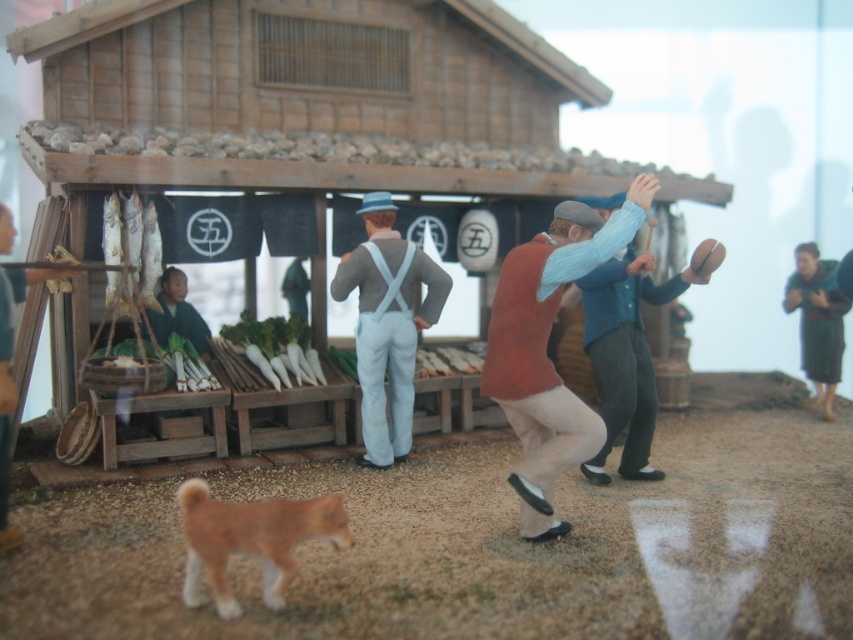
Between point (387, 451) and point (614, 374), which one is positioned in front?

Point (614, 374)

You are a GUI agent. You are given a task and a screenshot of the screen. Output one action in this format:
    pyautogui.click(x=<x>, y=<y>)
    Task: Click on the matte gray suspenders at center
    
    Given the screenshot: What is the action you would take?
    pyautogui.click(x=387, y=324)

At what (x,y) coordinates should I click in order to perform the action: click on matte gray suspenders at center. Please return your answer as a coordinate pair (x, y). This screenshot has height=640, width=853. Looking at the image, I should click on (387, 324).

Is light blue sweater at center to the left of blue wool sweater at right from the viewer's perspective?

Yes, light blue sweater at center is to the left of blue wool sweater at right.

Does point (525, 428) come behind point (630, 435)?

No, (525, 428) is in front of (630, 435).

Find the location of a particular element. light blue sweater at center is located at coordinates point(544,348).

Which is in front, point (637, 449) or point (839, 314)?

Point (637, 449)

Does blue wool sweater at right appear on the right side of green woolen sweater at right?

In fact, blue wool sweater at right is to the left of green woolen sweater at right.

Between point (589, 342) and point (830, 420), which one is positioned in front?

Point (589, 342) is in front.

Identify the location of blue wool sweater at right. (624, 356).